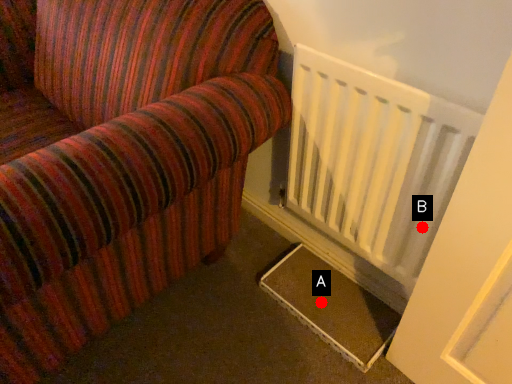
Question: Two points are circled on the image, labeled by A and B beside each circle. Which point appears farthest from the camera in this image?

Choices:
 (A) A is further
 (B) B is further

Answer: (A)